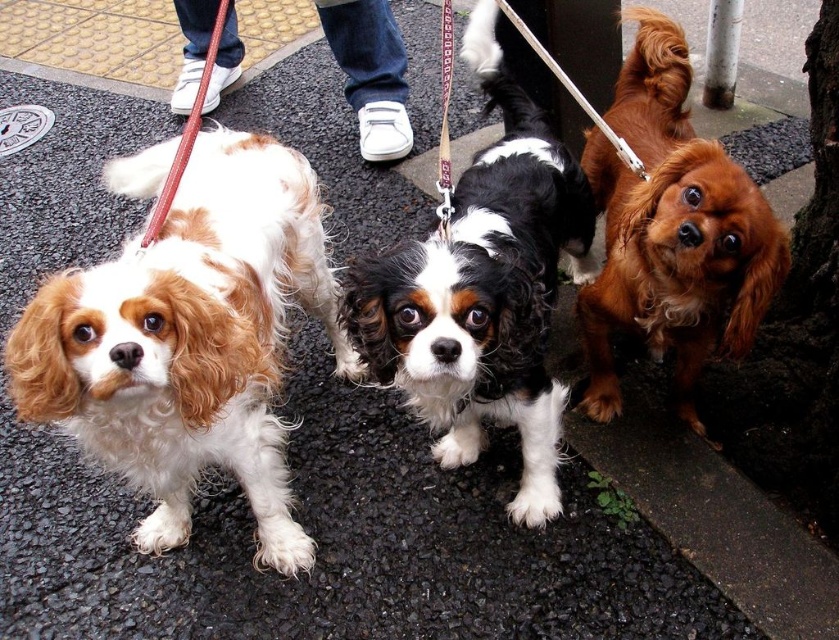
Question: Is white and brown fur at left to the left of black and white fur at center from the viewer's perspective?

Choices:
 (A) no
 (B) yes

Answer: (B)

Question: Is black and white fur at center wider than shiny brown fur at center?

Choices:
 (A) yes
 (B) no

Answer: (A)

Question: Which point is closer to the camera?

Choices:
 (A) (271, 420)
 (B) (539, 195)

Answer: (A)

Question: Does shiny brown fur at center appear on the right side of red leather leash at left?

Choices:
 (A) no
 (B) yes

Answer: (B)

Question: Which object appears closest to the camera in this image?

Choices:
 (A) brown leather leash at center
 (B) white and brown fur at left
 (C) white nylon leash at upper center

Answer: (B)

Question: Among these objects, which one is farthest from the camera?

Choices:
 (A) black and white fur at center
 (B) brown leather leash at center

Answer: (B)